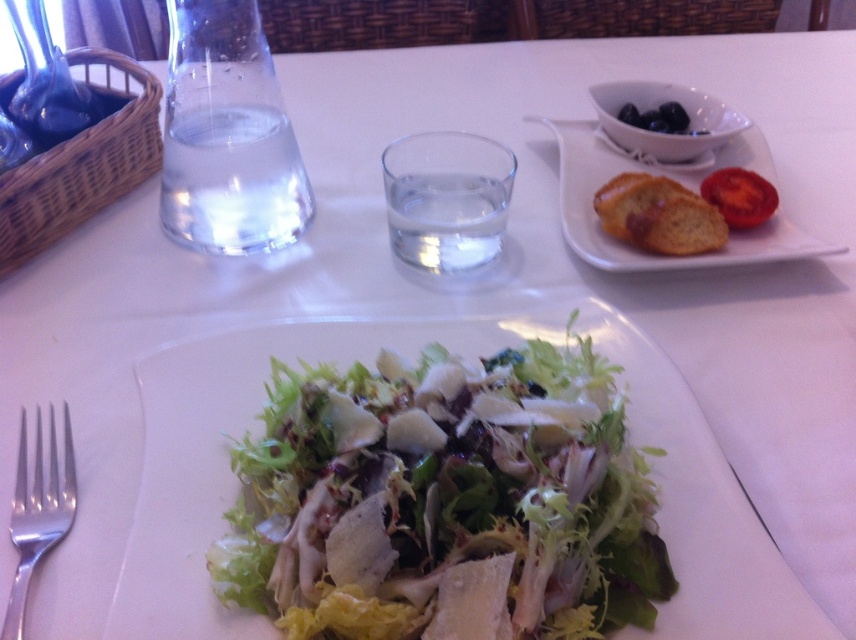
You are a server at a restaurant and need to place both the silver metallic fork at lower left and the red matte tomato at upper right on a small tray that can only hold items with a width of 10 cm or less. Based on their sizes, can both items fit on the tray?

The silver metallic fork at lower left is larger in width than the red matte tomato at upper right. Since the tray can only hold items up to 10 cm wide, if the fork exceeds this limit, it won generated as the description doesn mention specific measurements. However, since the fork is wider than the tomato, if the tomato is under 10 cm, the fork might still be too large. Without exact measurements, it is uncertain if both will fit.

You are a diner at the restaurant. You want to pick up the red matte tomato at upper right using the silver metallic fork at lower left. Considering their sizes, will the fork be able to hold the tomato without dropping it?

The silver metallic fork at lower left is larger in size than red matte tomato at upper right, so yes, the fork can hold the tomato without dropping it because its size is sufficient to grasp the tomato.

You are a customer at this restaurant and want to reach for the golden brown bread at upper right. Which direction should you move your hand relative to the green leafy salad at center?

The green leafy salad at center is below the golden brown bread at upper right, so you should move your hand upward from the green leafy salad at center to reach the golden brown bread at upper right.